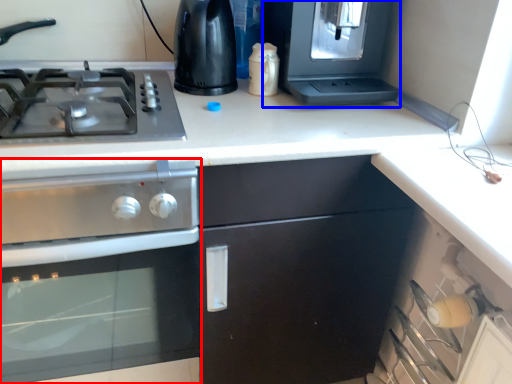
Question: Which object appears farthest to the camera in this image, kitchen appliance (highlighted by a red box) or appliance (highlighted by a blue box)?

Choices:
 (A) kitchen appliance
 (B) appliance

Answer: (B)